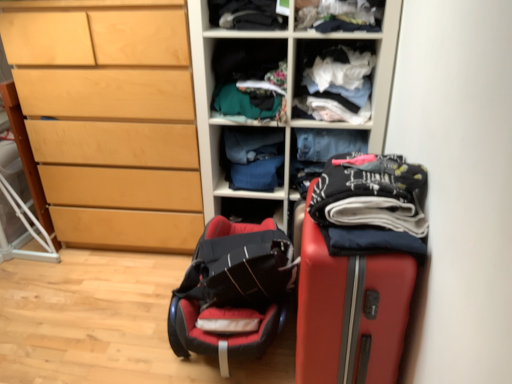
Question: Would you say rubberized red suitcase at right contains light wood chest of drawers at left?

Choices:
 (A) no
 (B) yes

Answer: (A)

Question: Is rubberized red suitcase at right bigger than light wood chest of drawers at left?

Choices:
 (A) yes
 (B) no

Answer: (B)

Question: Is rubberized red suitcase at right turned away from light wood chest of drawers at left?

Choices:
 (A) no
 (B) yes

Answer: (A)

Question: Is rubberized red suitcase at right in front of light wood chest of drawers at left?

Choices:
 (A) yes
 (B) no

Answer: (A)

Question: From the image's perspective, is rubberized red suitcase at right over light wood chest of drawers at left?

Choices:
 (A) yes
 (B) no

Answer: (B)

Question: Considering the relative positions of rubberized red suitcase at right and light wood chest of drawers at left in the image provided, is rubberized red suitcase at right behind light wood chest of drawers at left?

Choices:
 (A) yes
 (B) no

Answer: (B)

Question: Is blue fabric at center, arranged as the 5th clothing when viewed from the front, positioned before wooden shelves at center?

Choices:
 (A) yes
 (B) no

Answer: (B)

Question: Can you confirm if blue fabric at center, which appears as the 1th clothing when viewed from the back, is taller than wooden shelves at center?

Choices:
 (A) yes
 (B) no

Answer: (B)

Question: From a real-world perspective, is blue fabric at center, arranged as the 5th clothing when viewed from the front, located higher than wooden shelves at center?

Choices:
 (A) no
 (B) yes

Answer: (A)

Question: Can you confirm if blue fabric at center, arranged as the 5th clothing when viewed from the front, is smaller than wooden shelves at center?

Choices:
 (A) no
 (B) yes

Answer: (B)

Question: Is blue fabric at center, arranged as the 5th clothing when viewed from the front, completely or partially outside of wooden shelves at center?

Choices:
 (A) no
 (B) yes

Answer: (A)

Question: From the image's perspective, is blue fabric at center, which appears as the 1th clothing when viewed from the back, over wooden shelves at center?

Choices:
 (A) no
 (B) yes

Answer: (A)

Question: Can you confirm if wooden shelves at center is taller than dark gray fabric at upper center, positioned as the 3th clothing in back-to-front order?

Choices:
 (A) yes
 (B) no

Answer: (A)